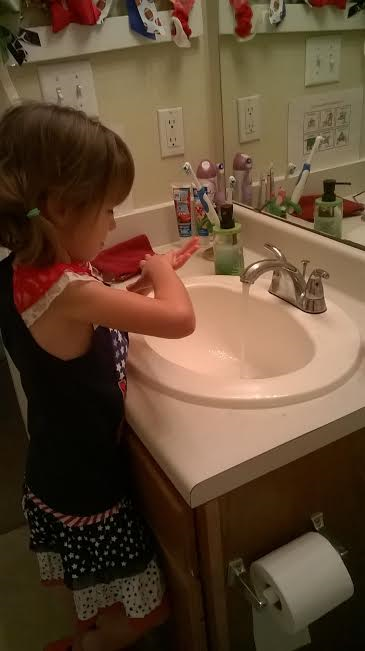
The width and height of the screenshot is (365, 651). What are the coordinates of `toilet roll` in the screenshot? It's located at (315, 551).